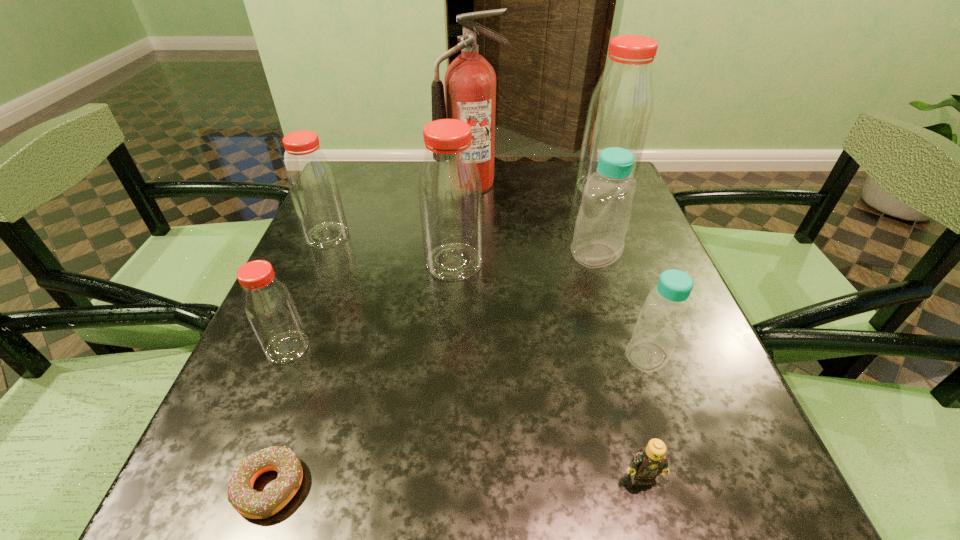
Where is `free location that satisfies the following two spatial constraints: 1. on the front side of the nearest red bottle; 2. on the right side of the third biggest red bottle`? The width and height of the screenshot is (960, 540). free location that satisfies the following two spatial constraints: 1. on the front side of the nearest red bottle; 2. on the right side of the third biggest red bottle is located at coordinates (279, 347).

Locate an element on the screen. The image size is (960, 540). vacant space that satisfies the following two spatial constraints: 1. on the front of the red fire extinguisher near the operation label; 2. on the right side of the smaller blue bottle is located at coordinates (466, 356).

Find the location of a particular element. Image resolution: width=960 pixels, height=540 pixels. free space that satisfies the following two spatial constraints: 1. on the back side of the smaller blue bottle; 2. on the right side of the shortest object is located at coordinates tap(316, 356).